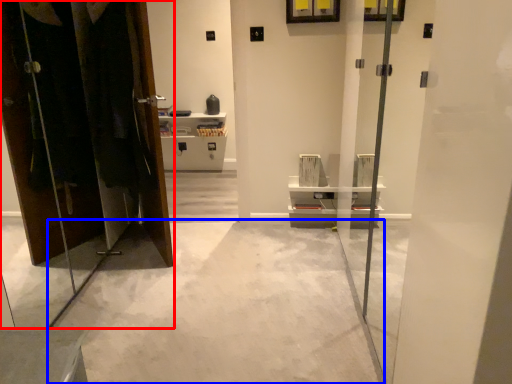
Question: Among these objects, which one is nearest to the camera, dresser (highlighted by a red box) or concrete (highlighted by a blue box)?

Choices:
 (A) dresser
 (B) concrete

Answer: (A)